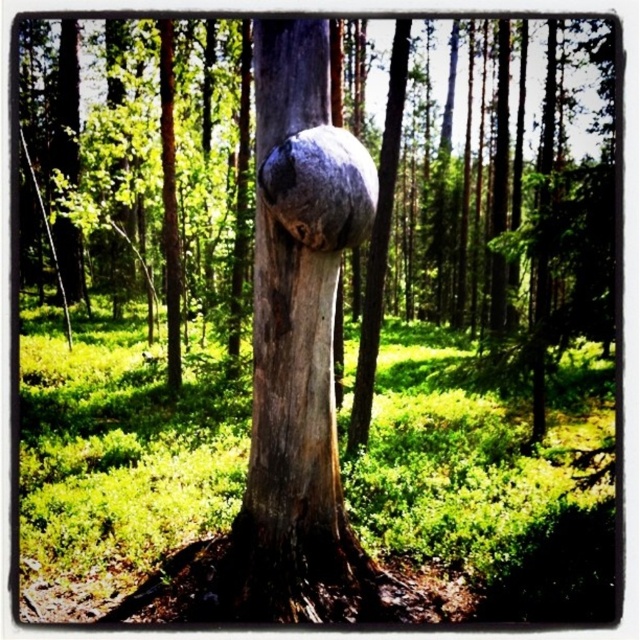
Is smooth bark tree trunk at center shorter than smooth gray bark at center?

No.

Is point (557, 292) positioned in front of point (253, 496)?

No.

The image size is (640, 640). I want to click on smooth bark tree trunk at center, so click(483, 189).

Is point (291, 157) closer to viewer compared to point (285, 218)?

Yes, it is.

Can you confirm if smooth gray bark at center is bigger than gray rough stone at center?

Yes.

Between point (342, 241) and point (323, 250), which one is positioned behind?

The point (323, 250) is more distant.

The image size is (640, 640). In order to click on smooth gray bark at center in this screenshot , I will do `click(294, 444)`.

Who is higher up, smooth bark tree trunk at center or gray rough stone at center?

smooth bark tree trunk at center is above.

The width and height of the screenshot is (640, 640). Describe the element at coordinates (483, 189) in the screenshot. I see `smooth bark tree trunk at center` at that location.

Find the location of a particular element. This screenshot has height=640, width=640. smooth bark tree trunk at center is located at coordinates (483, 189).